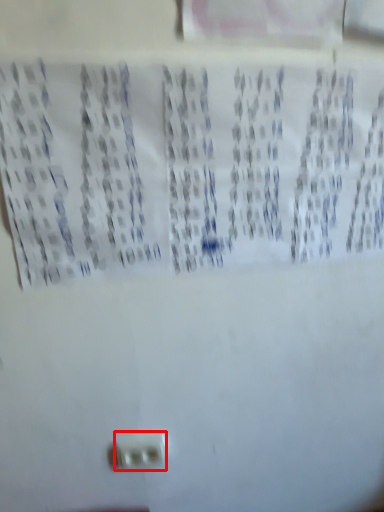
Question: From the image's perspective, where is power plugs and sockets (annotated by the red box) located relative to print?

Choices:
 (A) above
 (B) below

Answer: (B)